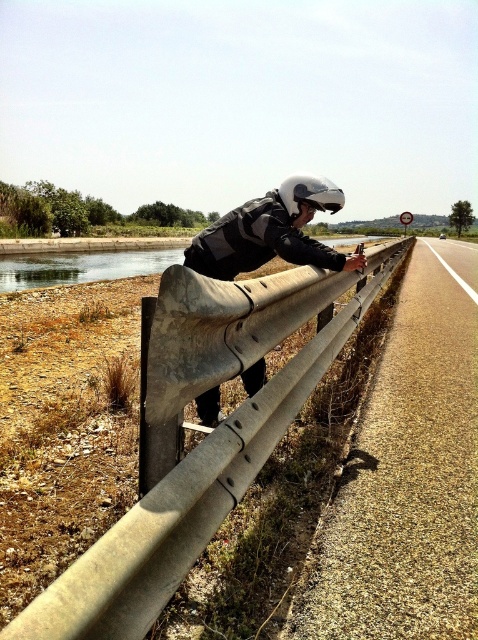
You are a delivery robot with a height of 1.2 meters. You need to navigate through the area shown in the image. The camera is positioned at a height of 1.5 meters. Will your height allow you to pass under the camera without hitting it while moving past the concrete barrier at center?

The camera is positioned at a height of 1.5 meters, and the delivery robot has a height of 1.2 meters. Since the robot is shorter than the camera, it can pass under the camera without hitting it while moving past the concrete barrier at center.

You are a delivery driver who needs to check your phone while on the road. You see the concrete barrier at center and the white matte helmet at upper center in your view. Which object is taller in your current view?

The concrete barrier at center is much taller than the white matte helmet at upper center in your current view.